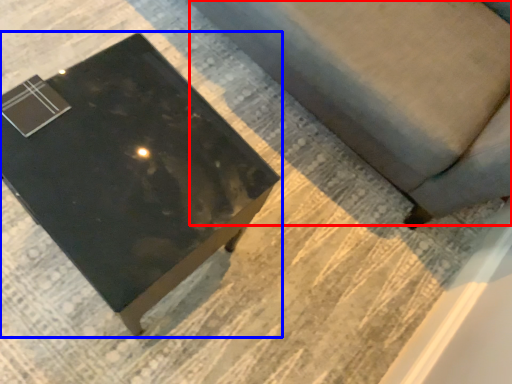
Question: Which point is closer to the camera, couch (highlighted by a red box) or table (highlighted by a blue box)?

Choices:
 (A) couch
 (B) table

Answer: (A)